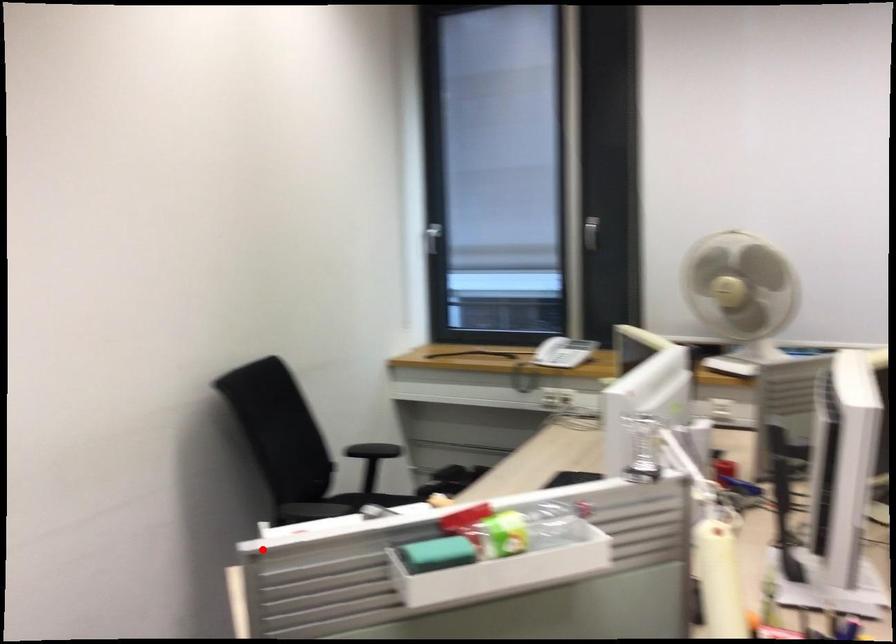
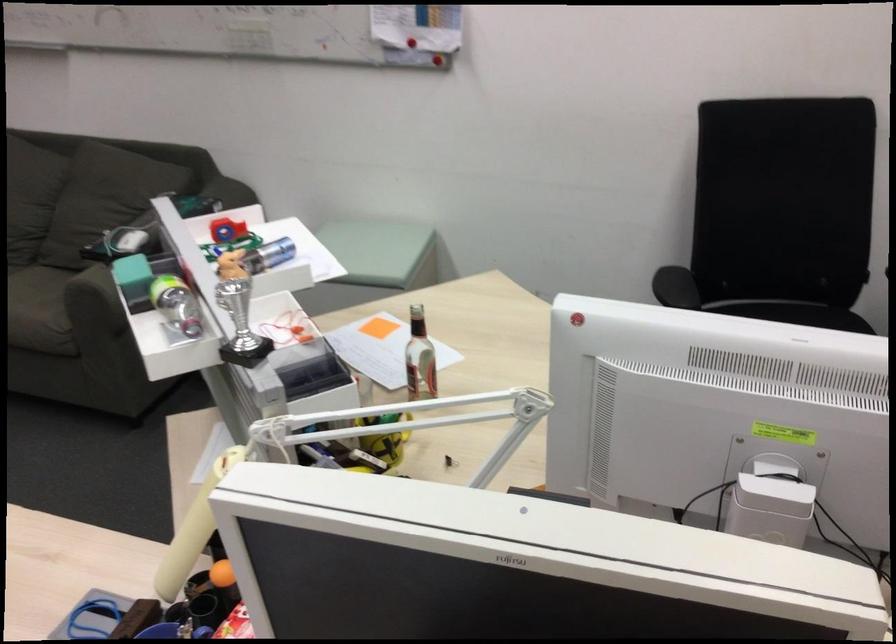
Question: A red point is marked in image1. In image2, is the corresponding 3D point closer to the camera or farther? Reply with the corresponding letter.

Choices:
 (A) The corresponding 3D point is closer.
 (B) The corresponding 3D point is farther.

Answer: (B)